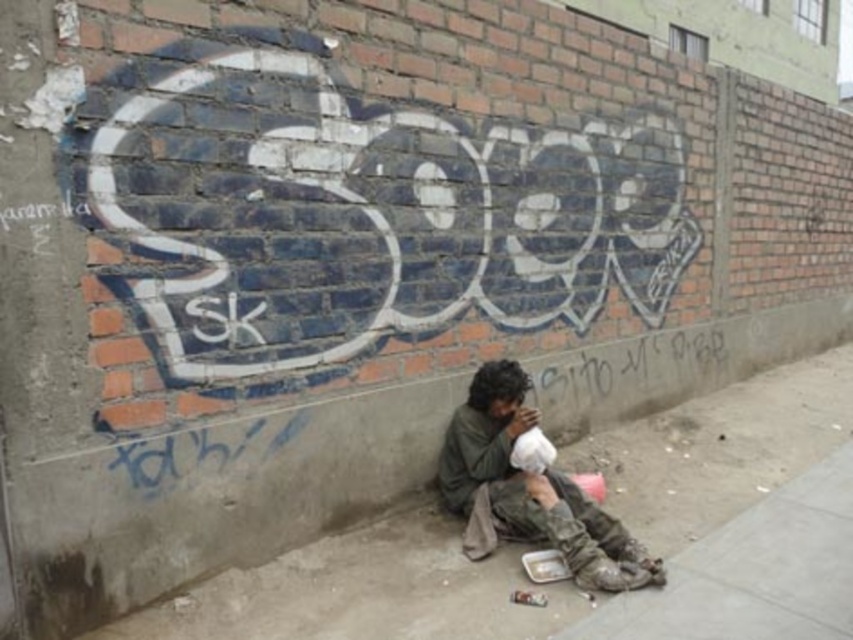
You are a delivery person trying to reach a package placed on the concrete pavement at lower center. You are currently standing next to the dirty green jacket at lower center. Can you easily access the package without moving the jacket?

The concrete pavement at lower center is shorter than the dirty green jacket at lower center, so the jacket is taller and might be blocking access to the pavement where the package is. You may need to move the jacket to reach the package.

You are a delivery person with a 1.5 meter wide cart. You need to pass through the area in front of the brick wall where the graffiti is. Can your cart fit between the concrete pavement at lower center and the dirty green jacket at lower center?

The concrete pavement at lower center is thinner than the dirty green jacket at lower center, but the exact width isn not provided. However, since the jacket is at the lower center and the pavement is also at the same position, it might mean the space between them is narrow. Without specific measurements, it is uncertain if the 1.5 meter cart can fit. Please check the actual space before proceeding.